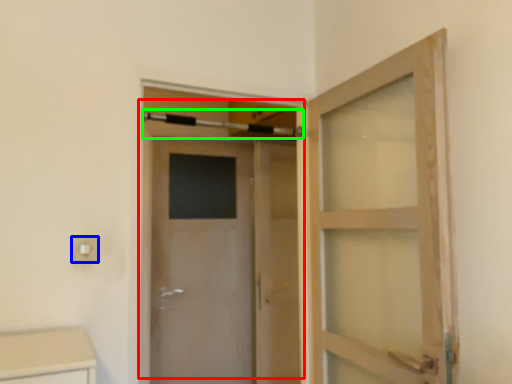
Question: Which object is the closest to the door (highlighted by a red box)? Choose among these: electric outlet (highlighted by a blue box) or towel bar (highlighted by a green box).

Choices:
 (A) electric outlet
 (B) towel bar

Answer: (B)